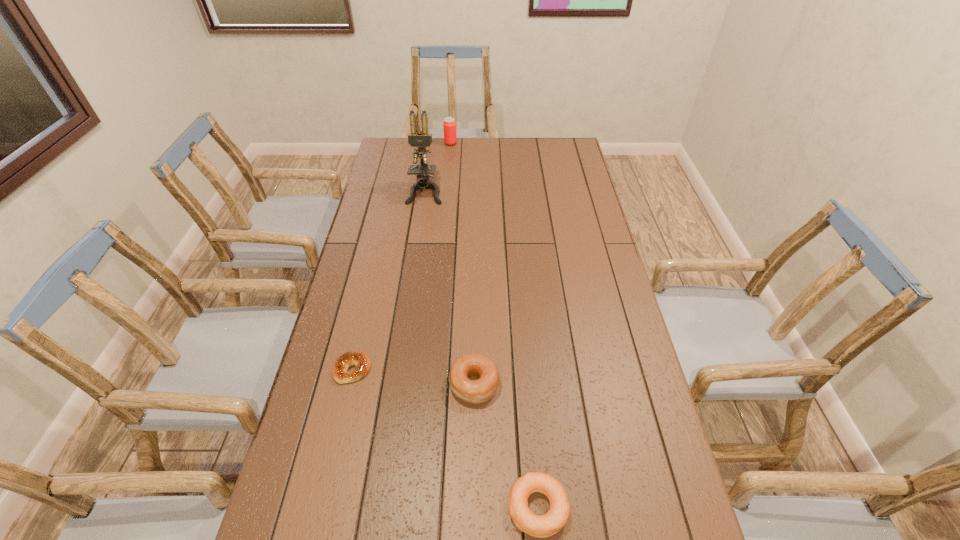
In order to click on the second farthest object in this screenshot , I will do `click(421, 139)`.

What are the coordinates of `the tallest object` in the screenshot? It's located at (421, 139).

Where is `beer can`? The width and height of the screenshot is (960, 540). beer can is located at coordinates (449, 125).

Locate an element on the screen. The height and width of the screenshot is (540, 960). the second tallest object is located at coordinates (449, 125).

Find the location of `the third shortest object`. the third shortest object is located at coordinates (479, 391).

The image size is (960, 540). What are the coordinates of `the second bagel from right to left` in the screenshot? It's located at (479, 391).

Locate an element on the screen. Image resolution: width=960 pixels, height=540 pixels. the leftmost bagel is located at coordinates (360, 359).

This screenshot has height=540, width=960. What are the coordinates of `the shortest object` in the screenshot? It's located at (360, 359).

The height and width of the screenshot is (540, 960). I want to click on free space located 0.100m at the eyepieces of the fourth nearest object, so click(420, 221).

Identify the location of vacant point located on the right of the beer can. The image size is (960, 540). (497, 144).